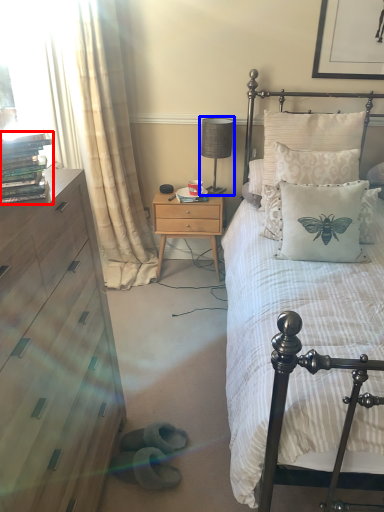
Question: Among these objects, which one is nearest to the camera, book (highlighted by a red box) or table lamp (highlighted by a blue box)?

Choices:
 (A) book
 (B) table lamp

Answer: (A)